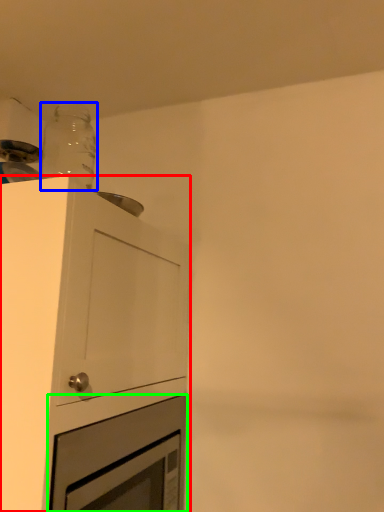
Question: Estimate the real-world distances between objects in this image. Which object is closer to cabinetry (highlighted by a red box), bottle (highlighted by a blue box) or oven (highlighted by a green box)?

Choices:
 (A) bottle
 (B) oven

Answer: (B)